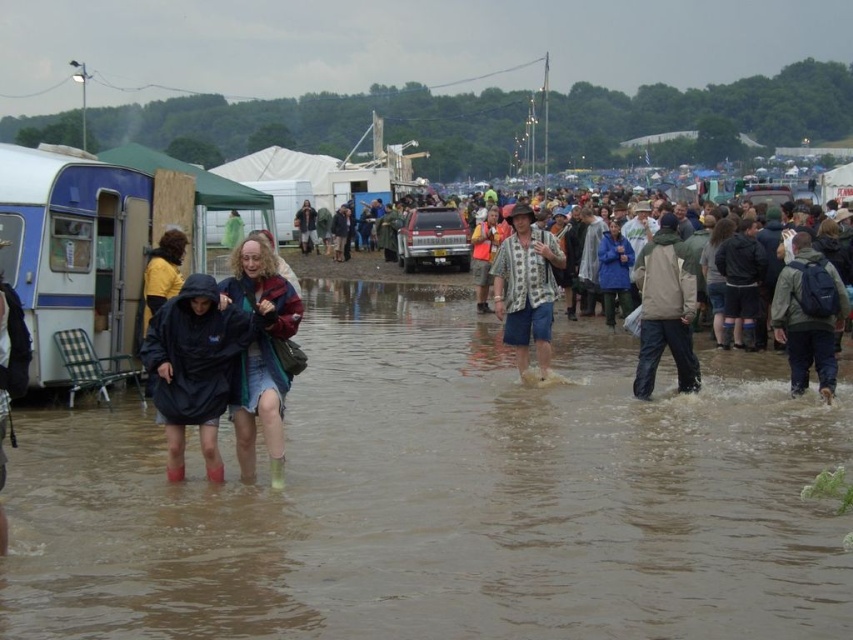
Does brown rubber boots at lower center have a lesser height compared to dark gray waterproof jacket at right?

Indeed, brown rubber boots at lower center has a lesser height compared to dark gray waterproof jacket at right.

Does brown rubber boots at lower center have a larger size compared to dark gray waterproof jacket at right?

Correct, brown rubber boots at lower center is larger in size than dark gray waterproof jacket at right.

Find the location of `brown rubber boots at lower center`. brown rubber boots at lower center is located at coordinates (444, 499).

Find the location of a particular element. brown rubber boots at lower center is located at coordinates (444, 499).

Who is lower down, rubber rain boots at lower left or dark gray waterproof jacket at right?

rubber rain boots at lower left is below.

Is rubber rain boots at lower left to the left of dark gray waterproof jacket at right from the viewer's perspective?

Yes, rubber rain boots at lower left is to the left of dark gray waterproof jacket at right.

Does point (209, 292) come in front of point (659, 256)?

Yes, it is.

The image size is (853, 640). Identify the location of rubber rain boots at lower left. (195, 368).

Does dark gray waterproof jacket at right have a lesser height compared to patterned fabric shirt at center?

Yes.

Can you confirm if dark gray waterproof jacket at right is thinner than patterned fabric shirt at center?

Yes.

Is point (689, 387) more distant than point (532, 284)?

No.

In order to click on dark gray waterproof jacket at right in this screenshot , I will do `click(665, 308)`.